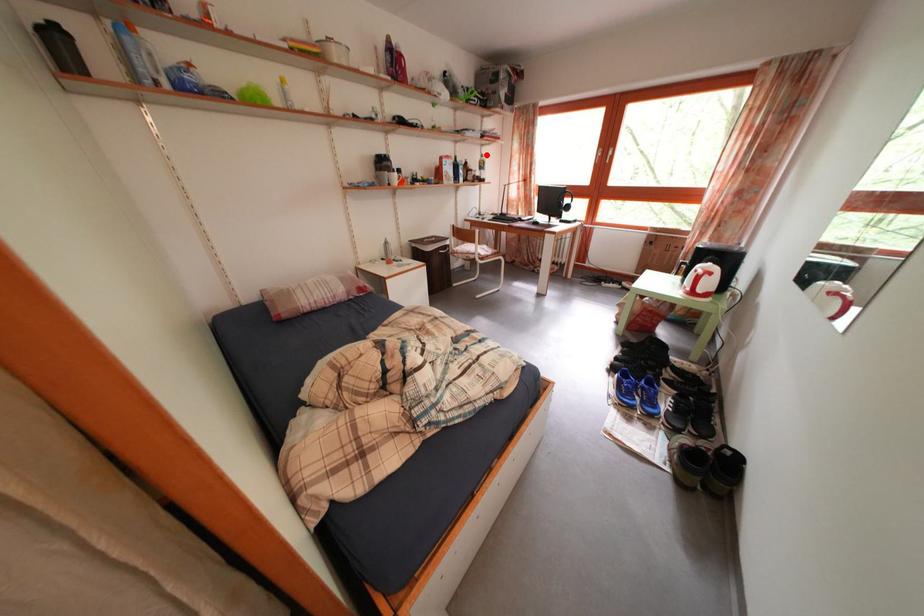
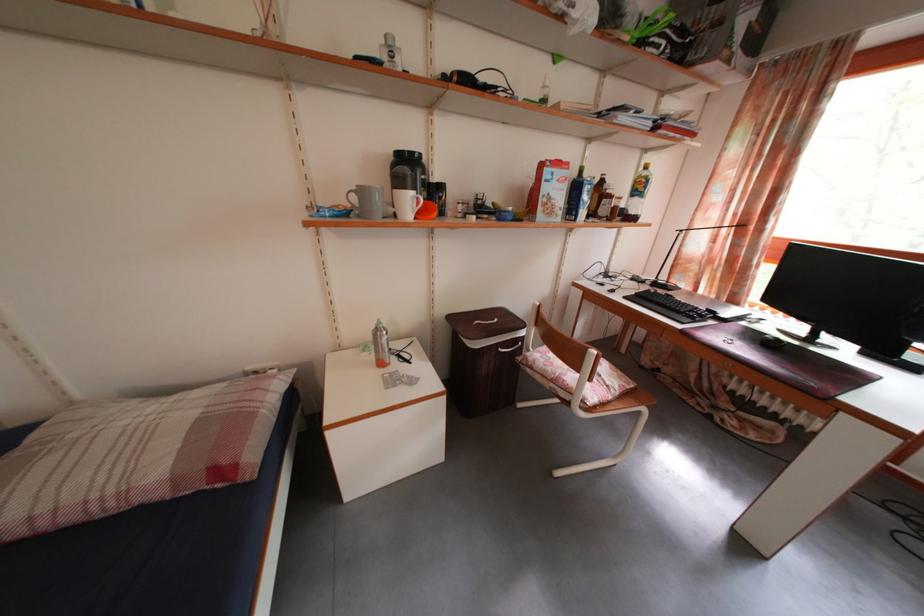
Find the pixel in the second image that matches the highlighted location in the first image.

(643, 161)